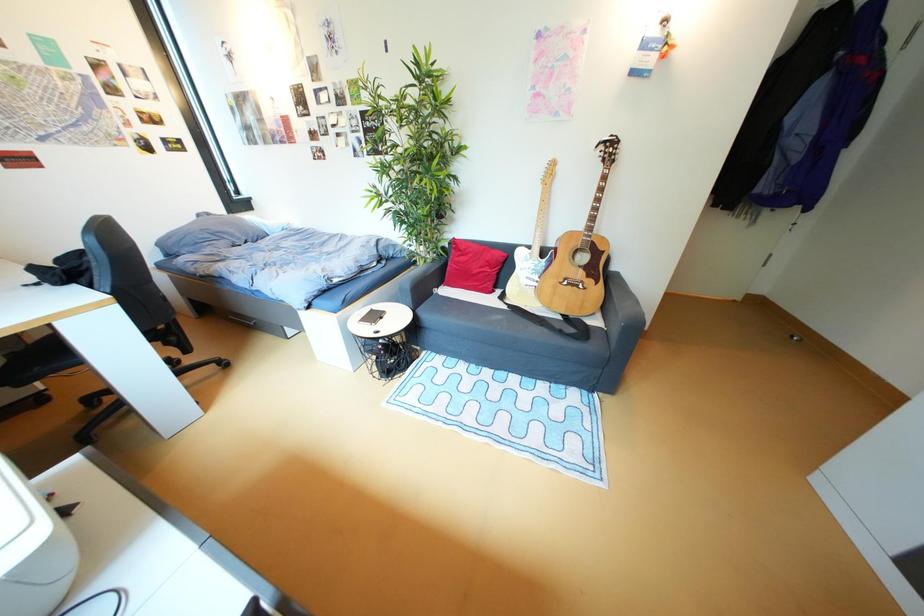
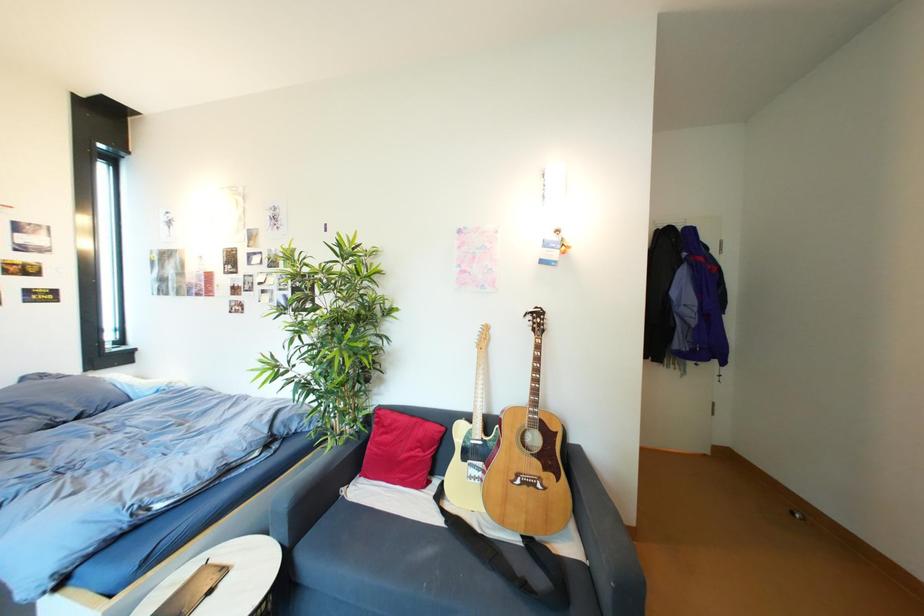
What movement of the cameraman would produce the second image?

The cameraman walked toward right, forward.